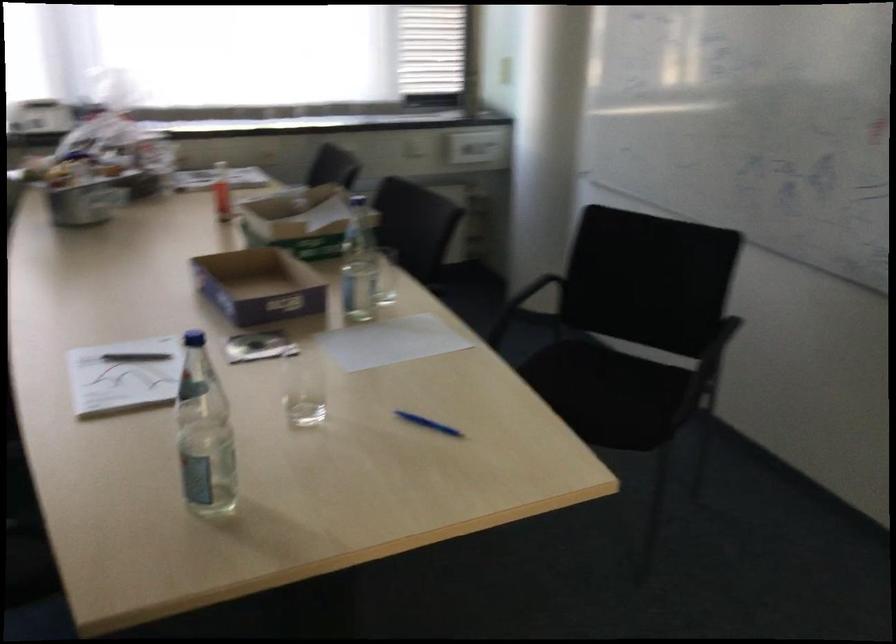
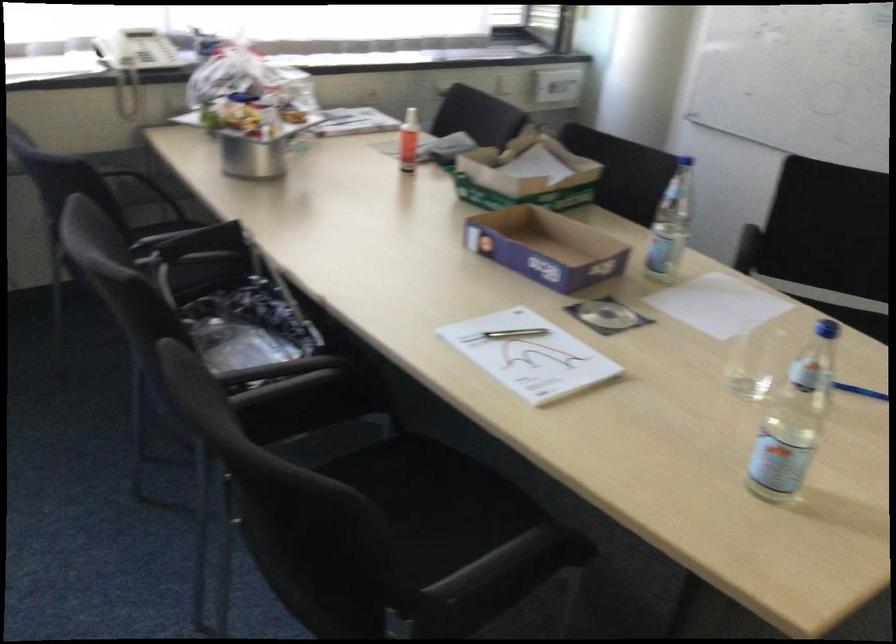
The point at (149, 360) is marked in the first image. Where is the corresponding point in the second image?

(514, 333)